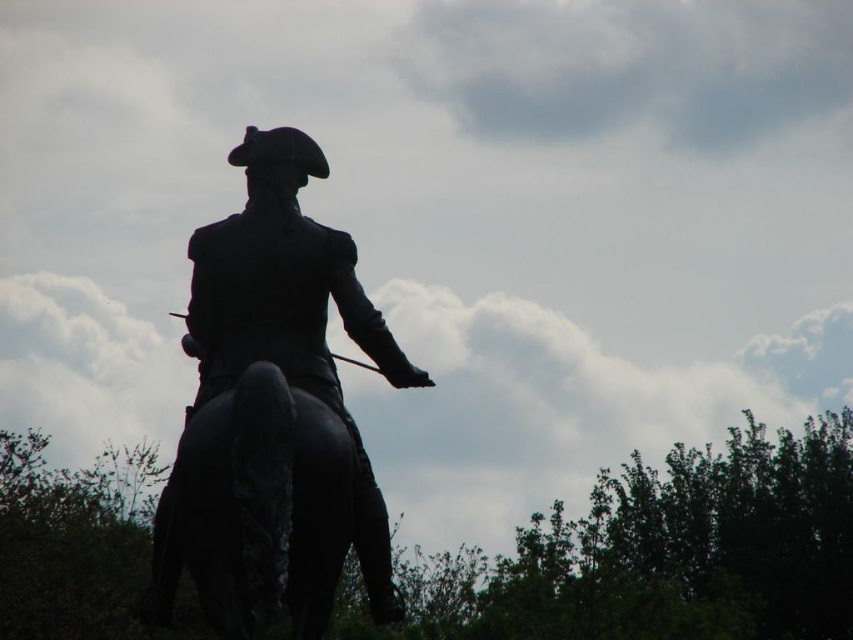
You are standing at a point 15 meters away from the statue. The statue has a point marked at coordinates point (236, 221). If you want to touch this point on the statue, how much closer do you need to move?

The point (236, 221) is 15.79 meters away from the camera. Since you are currently 15 meters away, you need to move 0.79 meters closer to reach it.

You are a tour guide explaining the statue to visitors. You want to mention the position of the black polished statue at center and the shiny black horse at center. Which object is located to the right side?

The black polished statue at center is located to the right of the shiny black horse at center.

You are an art conservator examining the statue and horse in the image. You need to determine if the statue will fit through a doorway that is 2 meters tall. The shiny black horse at center is known to be 1.5 meters tall. Can the black polished statue at center pass through the doorway?

The black polished statue at center is taller than the shiny black horse at center, which is 1.5 meters tall. Since the statue is taller than 1.5 meters and the doorway is 2 meters tall, it is possible that the statue can pass through, but we need to know the exact height of the statue to be certain.